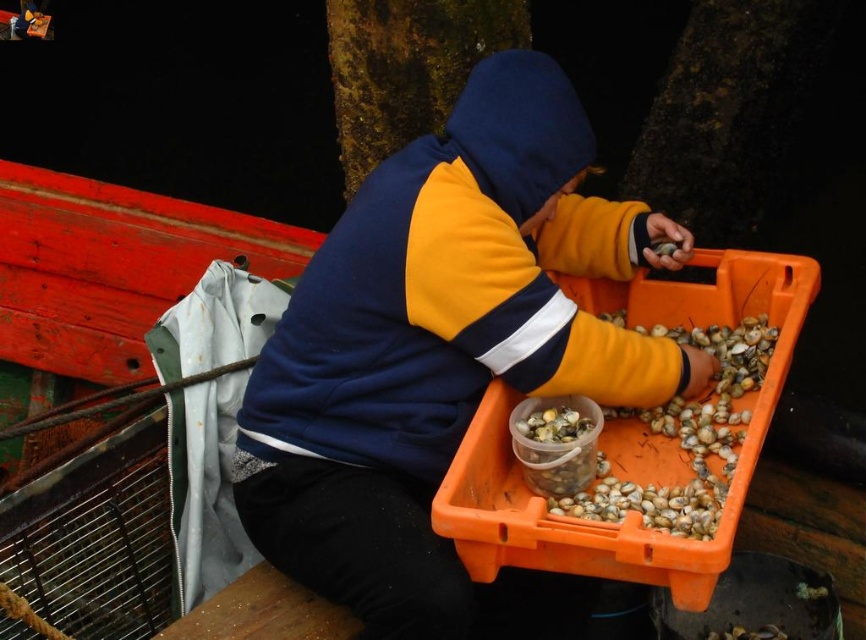
You are a photographer trying to capture the person in the scene. If you want to include both the matte blue and yellow hoodie at center and the translucent plastic shells at lower right in the same frame, which object should you focus on first to ensure both are in focus?

The matte blue and yellow hoodie at center is much taller than the translucent plastic shells at lower right, so focusing on the matte blue and yellow hoodie at center first would ensure both are in focus since it is farther away and occupies more space in the frame.

You are a marine biologist examining the sorting process of shells. You notice two items in the scene. One is the translucent plastic shells at lower right and the other is the translucent plastic container at center. Which item is positioned closer to your viewpoint?

The translucent plastic shells at lower right are closer to the viewer than the translucent plastic container at center.

You are a delivery person who needs to place a matte blue and yellow hoodie at center and a translucent plastic container at center into a small storage box. Can both items fit inside the box if the box can only hold items smaller than the hoodie?

The matte blue and yellow hoodie at center is bigger than the translucent plastic container at center. Since the box can only hold items smaller than the hoodie, only the translucent plastic container at center can fit inside the box.